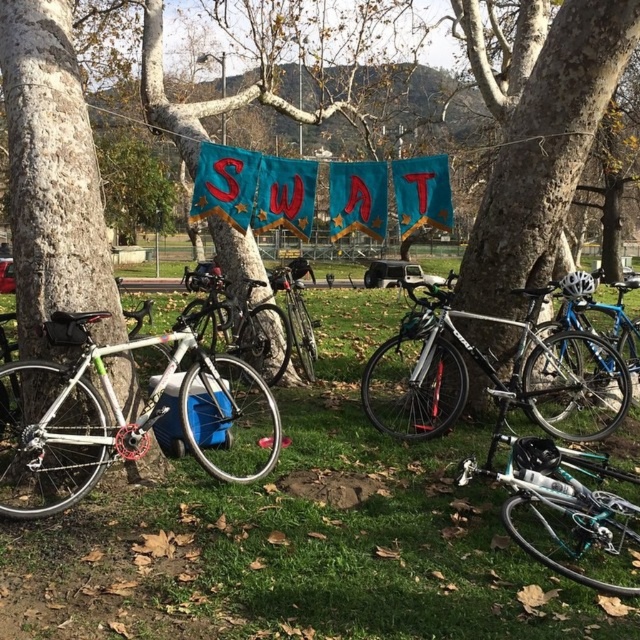
Question: Is smooth bark tree at center positioned at the back of teal matte bicycle at lower right?

Choices:
 (A) yes
 (B) no

Answer: (A)

Question: Can you confirm if smooth bark tree at left is smaller than shiny blue bicycle at center?

Choices:
 (A) no
 (B) yes

Answer: (A)

Question: Which of the following is the closest to the observer?

Choices:
 (A) smooth bark tree at center
 (B) teal matte bicycle at lower right

Answer: (B)

Question: Which of the following is the closest to the observer?

Choices:
 (A) shiny silver bicycle at center
 (B) teal matte bicycle at lower right
 (C) smooth bark tree at center

Answer: (B)

Question: Is smooth bark tree at center behind teal matte bicycle at lower right?

Choices:
 (A) yes
 (B) no

Answer: (A)

Question: Which point appears farthest from the camera in this image?

Choices:
 (A) (44, 509)
 (B) (294, 333)
 (C) (596, 412)
 (D) (230, 627)

Answer: (B)